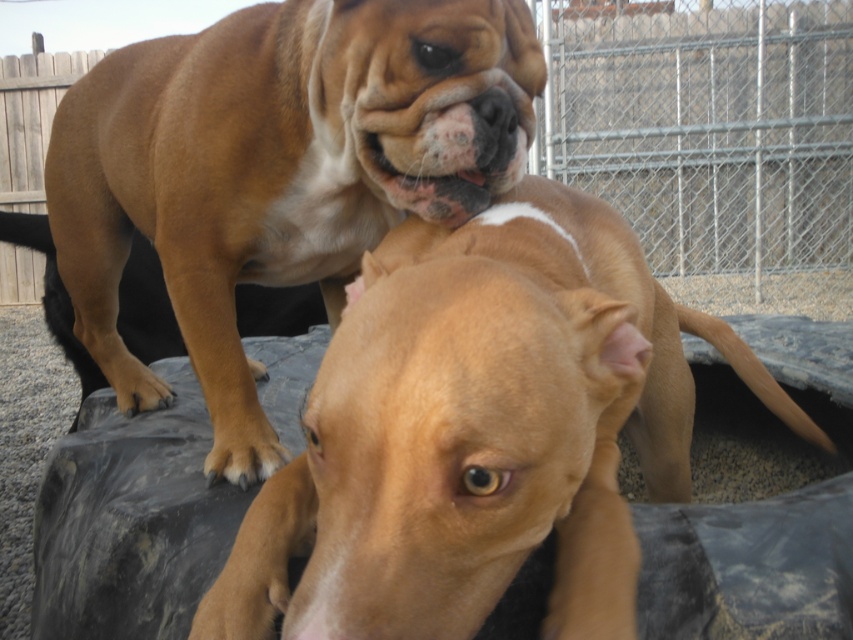
Question: Which point appears closest to the camera in this image?

Choices:
 (A) pos(456,564)
 (B) pos(453,72)

Answer: (A)

Question: Where is smooth tan dog at center located in relation to brown matte dog at center in the image?

Choices:
 (A) right
 (B) left

Answer: (A)

Question: Can you confirm if smooth tan dog at center is positioned to the right of brown matte dog at center?

Choices:
 (A) no
 (B) yes

Answer: (B)

Question: In this image, where is smooth tan dog at center located relative to brown matte dog at center?

Choices:
 (A) left
 (B) right

Answer: (B)

Question: Which point is closer to the camera?

Choices:
 (A) brown matte dog at center
 (B) smooth tan dog at center

Answer: (B)